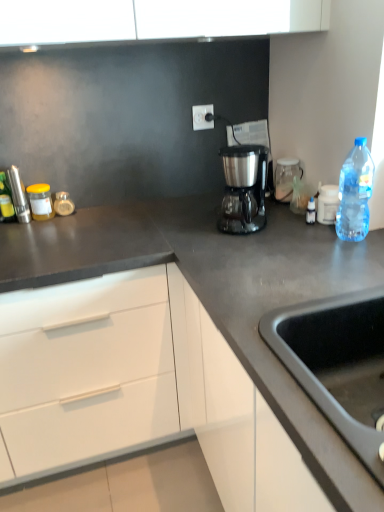
Locate an element on the screen. The image size is (384, 512). free space above dark gray matte countertop at center (from a real-world perspective) is located at coordinates (114, 228).